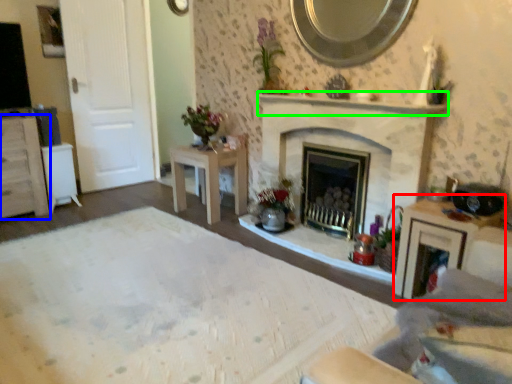
Question: Based on their relative distances, which object is nearer to vanity (highlighted by a red box)? Choose from cabinetry (highlighted by a blue box) and mantle (highlighted by a green box).

Choices:
 (A) cabinetry
 (B) mantle

Answer: (B)